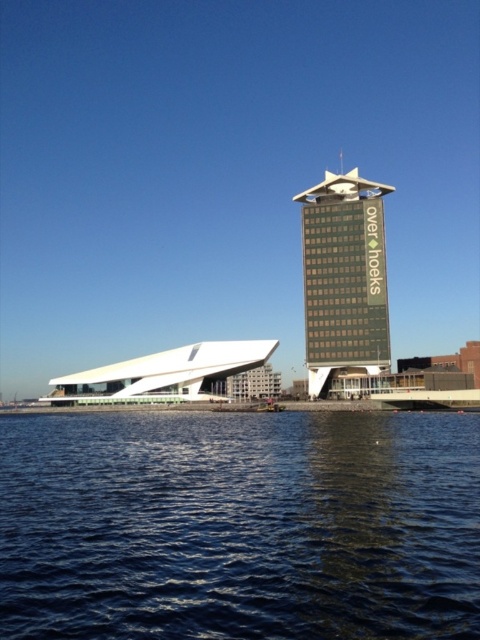
You are standing at the waterfront and see two points marked in the scene. The first is at coordinate point (237, 524) and the second at point (309, 392). Which point appears closer to you?

Point (237, 524) is closer to the viewer than point (309, 392).

You are standing at point (408,442) and want to reach the nearest building. The two buildings are 51.84 meters apart. Which building should you head towards?

The point (408,442) is closer to the dark green facade building on the right than the white facade building on the left, so you should head towards the dark green facade building on the right.

You are a tourist standing on a bridge overlooking the dark blue water at lower center and the green glass building at center. Which object is positioned lower in the scene?

The dark blue water at lower center is positioned below the green glass building at center, so it is lower in the scene.